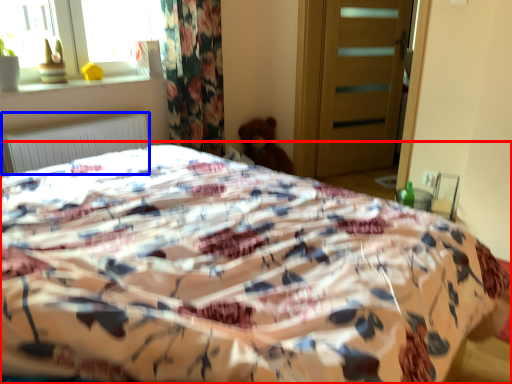
Question: Which point is closer to the camera, bed (highlighted by a red box) or radiator (highlighted by a blue box)?

Choices:
 (A) bed
 (B) radiator

Answer: (A)